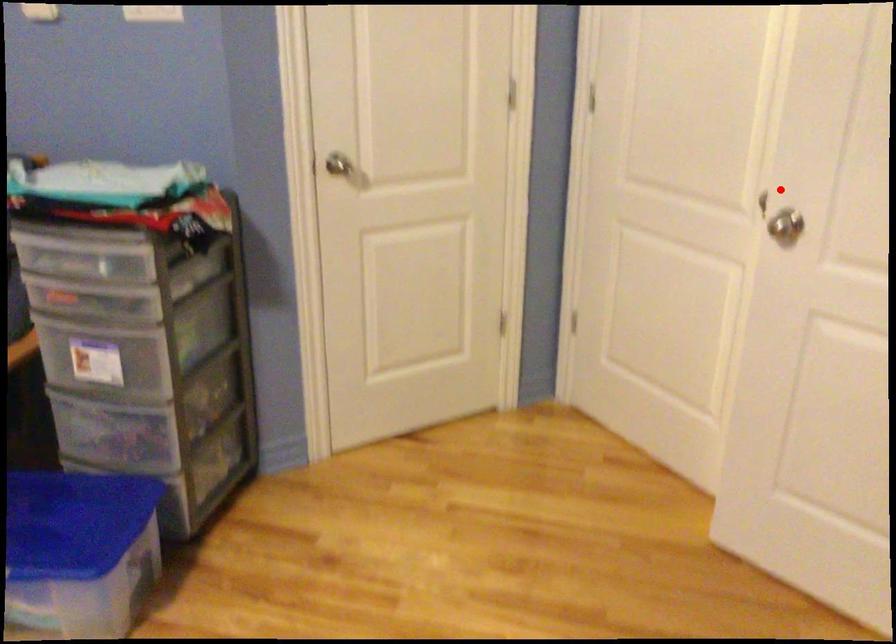
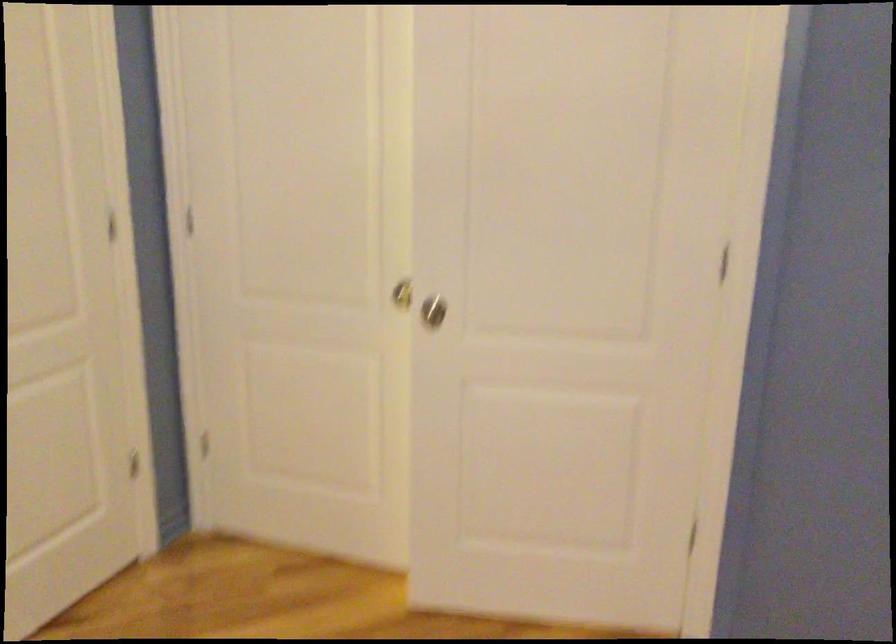
Question: I am providing you with two images of the same scene from different viewpoints. Given a red point in image1, look at the same physical point in image2. Is it:

Choices:
 (A) Closer to the viewpoint
 (B) Farther from the viewpoint

Answer: (B)